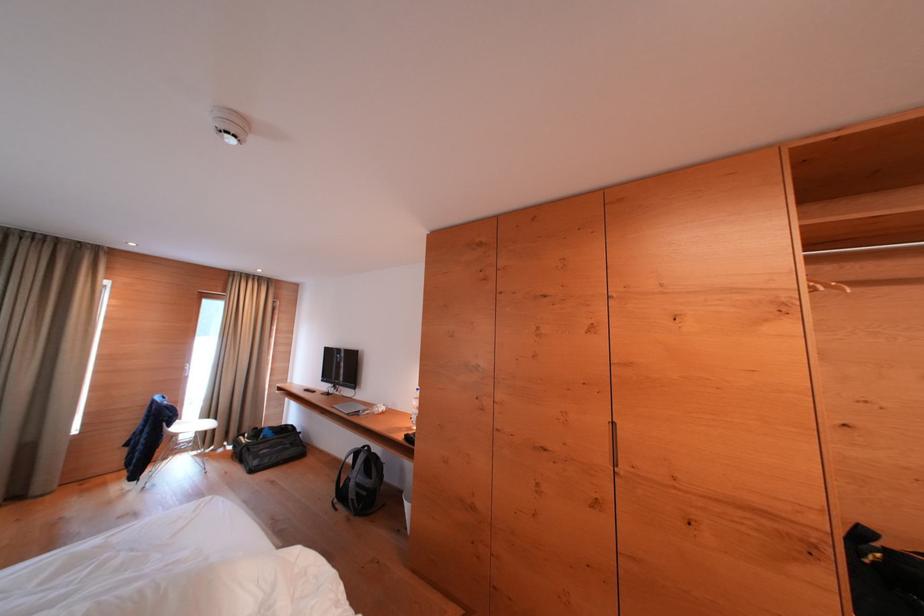
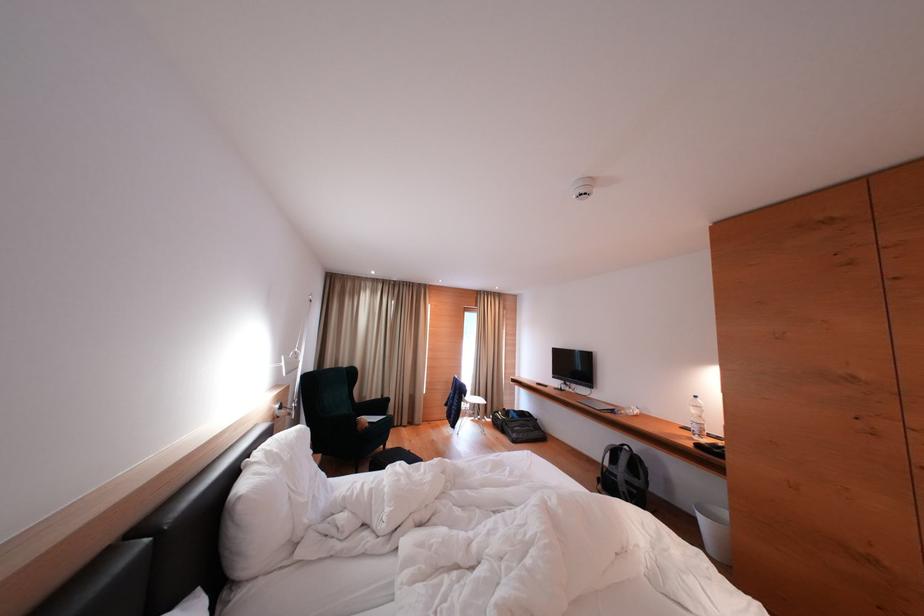
Find the pixel in the second image that matches point (407, 440) in the first image.

(696, 448)